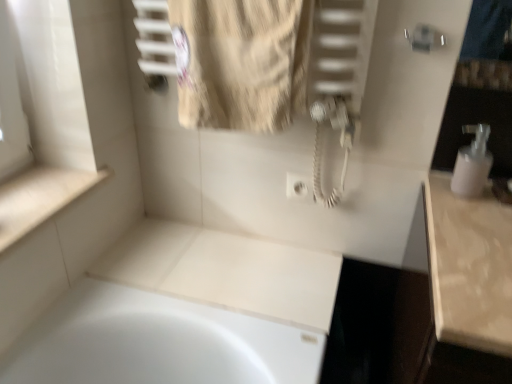
This screenshot has height=384, width=512. Find the location of `vacant space in beige textured towel at upper center (from a real-world perspective)`. vacant space in beige textured towel at upper center (from a real-world perspective) is located at coordinates (237, 268).